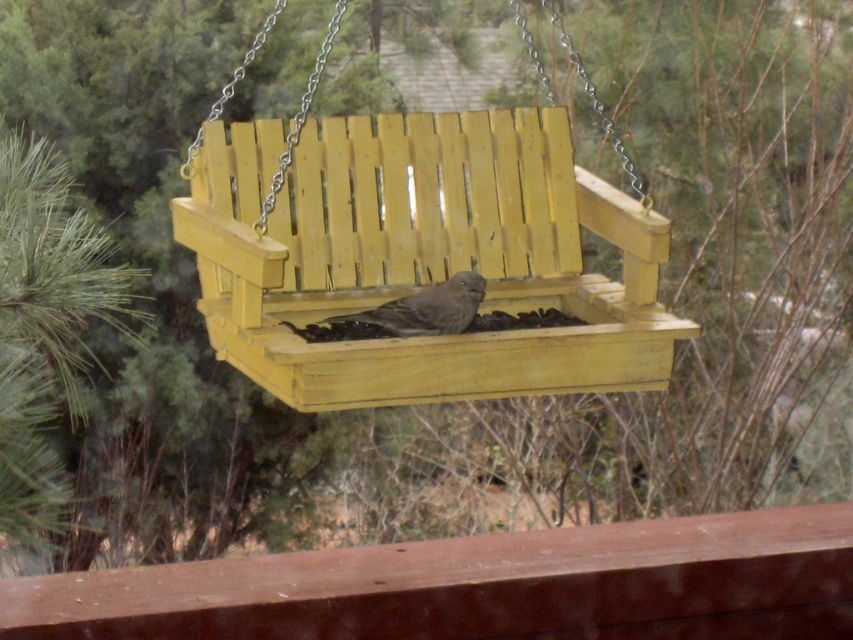
Question: Which object is closer to the camera taking this photo?

Choices:
 (A) yellow wood swing at center
 (B) brown matte bird at center

Answer: (A)

Question: Which object appears farthest from the camera in this image?

Choices:
 (A) yellow wood swing at center
 (B) brown matte bird at center

Answer: (B)

Question: Does yellow wood swing at center have a larger size compared to brown matte bird at center?

Choices:
 (A) no
 (B) yes

Answer: (B)

Question: Can you confirm if yellow wood swing at center is thinner than brown matte bird at center?

Choices:
 (A) yes
 (B) no

Answer: (B)

Question: Can you confirm if yellow wood swing at center is bigger than brown matte bird at center?

Choices:
 (A) no
 (B) yes

Answer: (B)